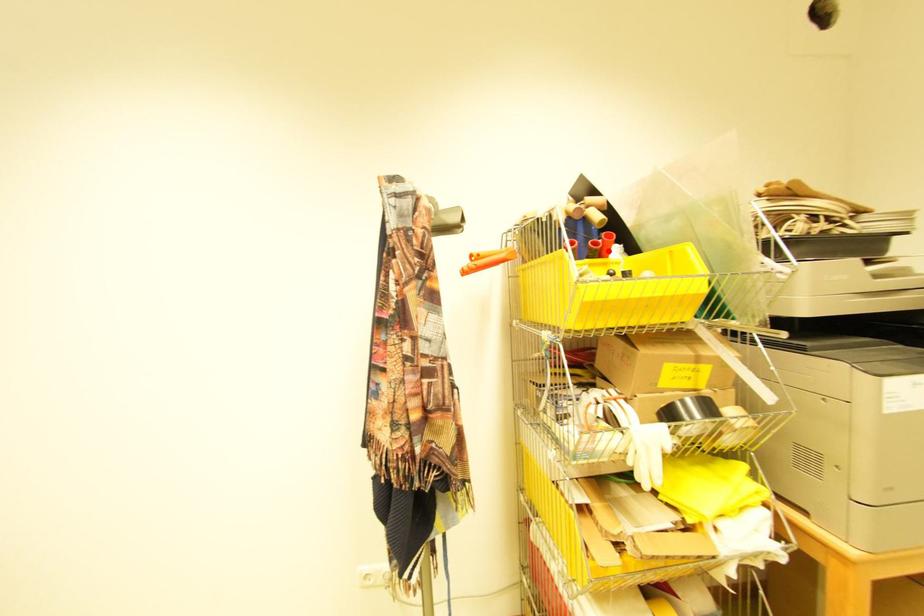
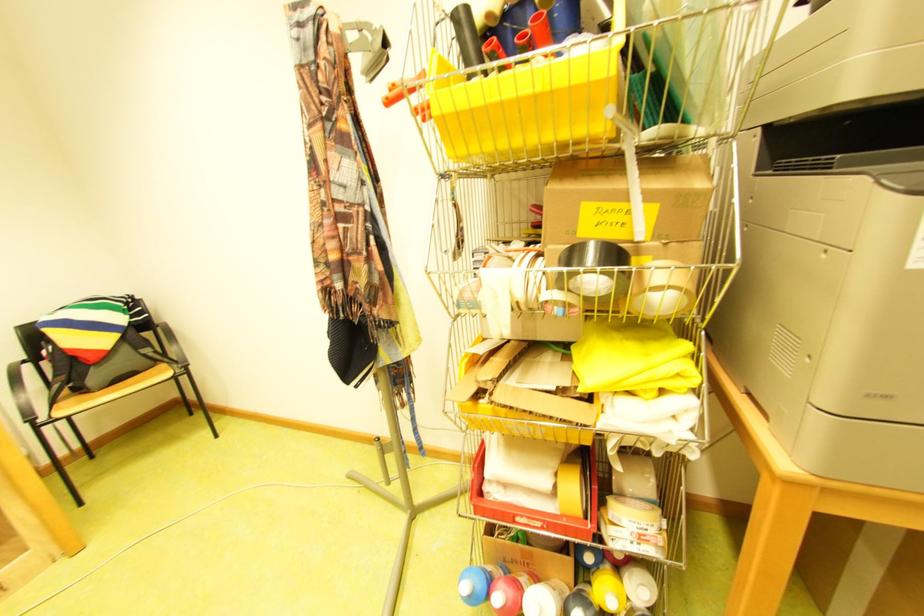
Question: I am providing you with two images of the same scene from different viewpoints. A red point is marked on the first image. Is the red point's position out of view in image 2?

Choices:
 (A) Yes
 (B) No

Answer: (A)